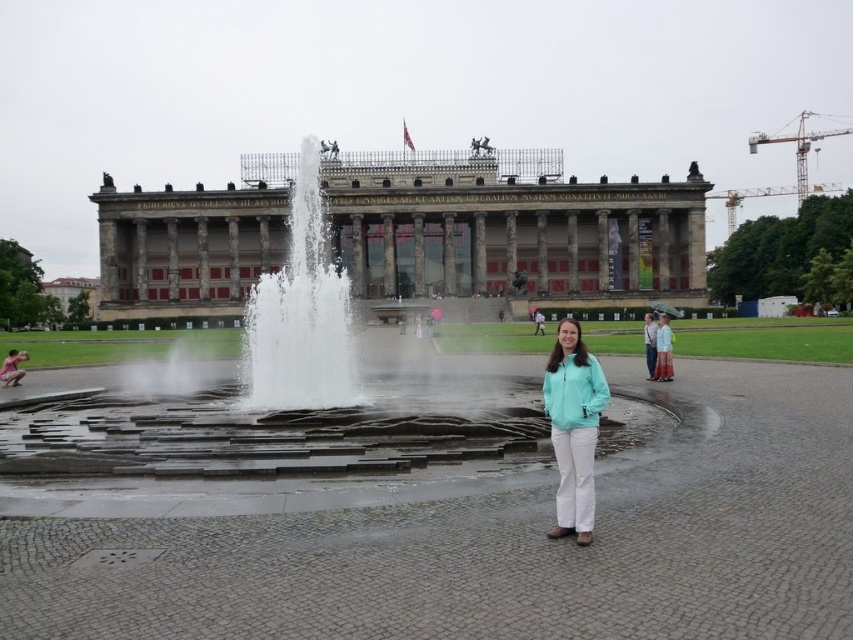
You are a visitor standing in front of the museum entrance. You see the white stone fountain at center and the teal fabric jacket at center. Which object is taller?

The white stone fountain at center is taller than the teal fabric jacket at center.

You are standing at point 0.5, 0.5 in the image. Which direction should you move to reach the marble building at center?

Since the marble building at center is located at point (514, 232), and you are at (426, 320), you should move southwest to reach it.